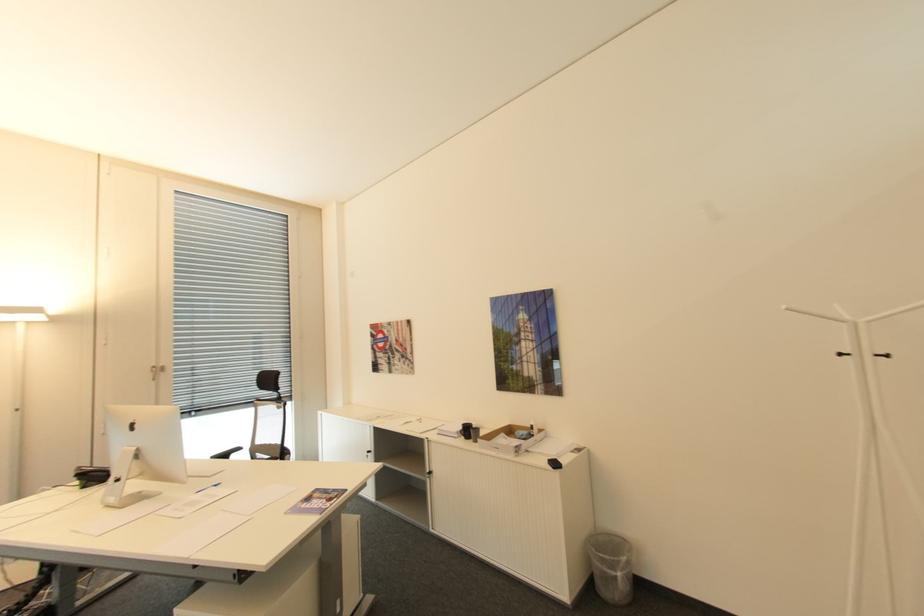
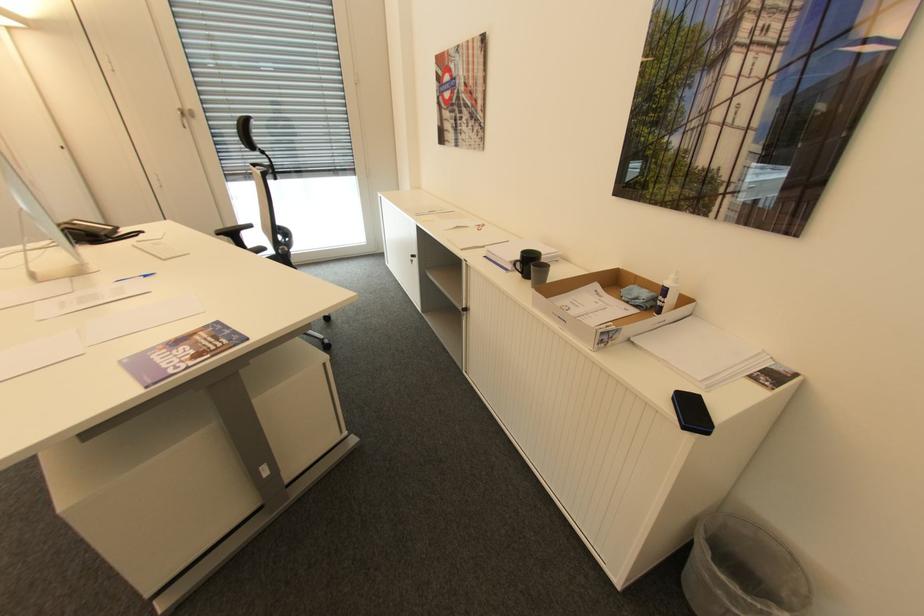
Where in the second image is the point corresponding to [602,562] from the first image?

(711, 576)